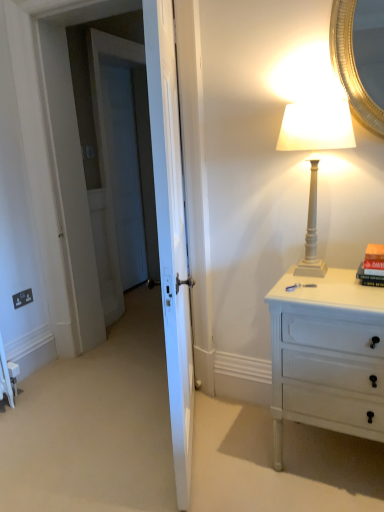
What are the coordinates of `vacant area on top of white painted wood chest of drawers at right (from a real-world perspective)` in the screenshot? It's located at (334, 287).